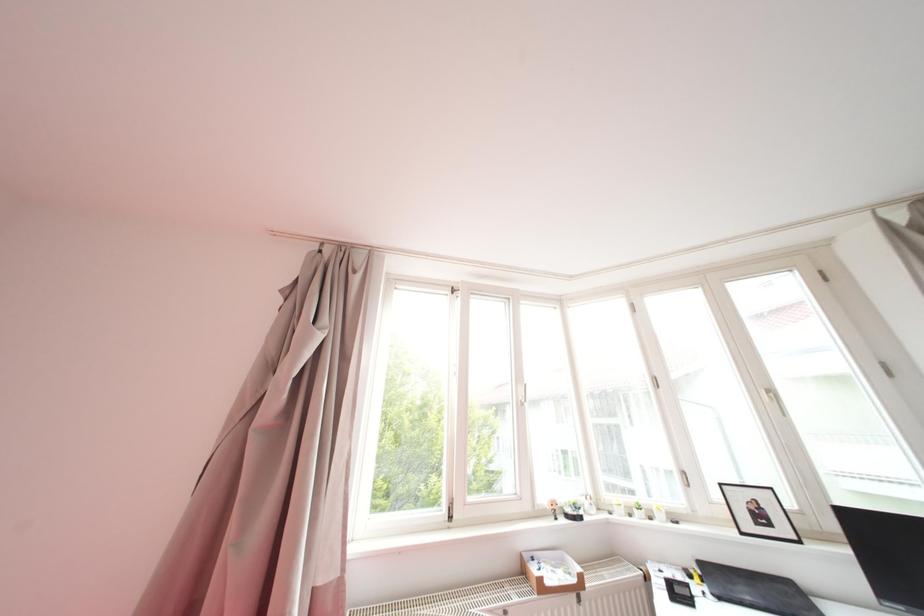
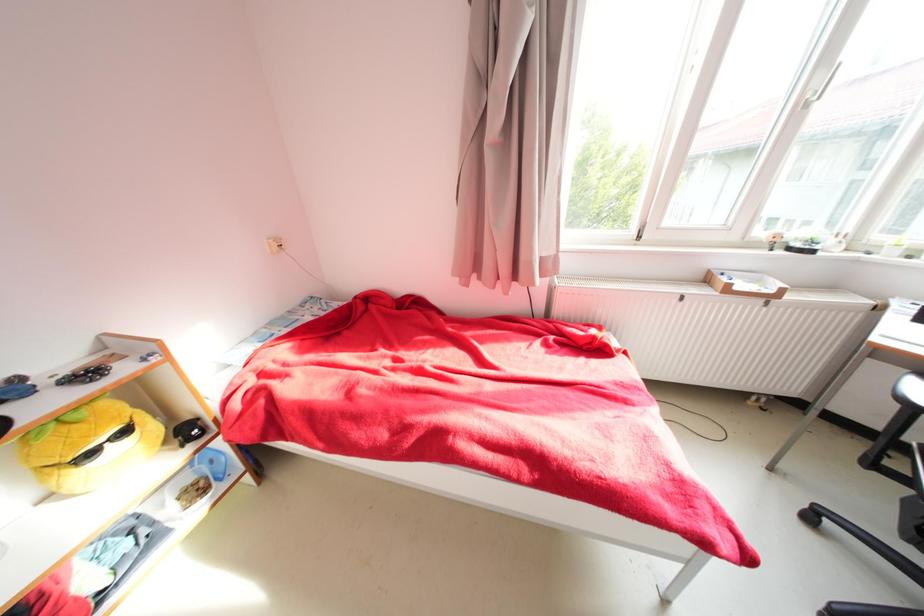
Based on the continuous images, in which direction is the camera rotating?

The camera's rotation is toward left-down.